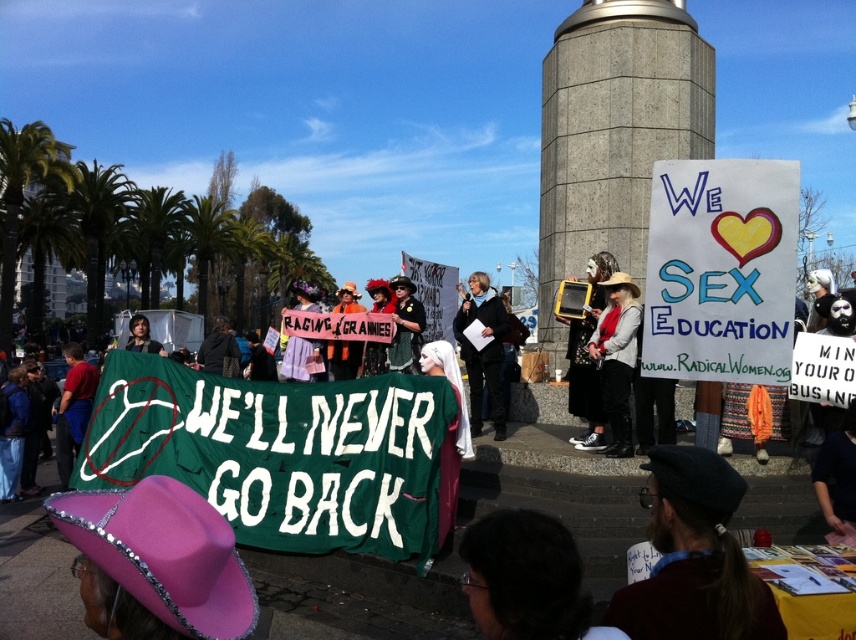
Question: Which point is farther from the camera taking this photo?

Choices:
 (A) (587, 364)
 (B) (483, 314)

Answer: (B)

Question: In this image, where is white knit sweater at center located relative to matte black dress at center?

Choices:
 (A) left
 (B) right

Answer: (B)

Question: Is black matte jacket at center to the left of yellow plastic sign at center from the viewer's perspective?

Choices:
 (A) yes
 (B) no

Answer: (A)

Question: Considering the relative positions of white knit sweater at center and matte black dress at center in the image provided, where is white knit sweater at center located with respect to matte black dress at center?

Choices:
 (A) left
 (B) right

Answer: (B)

Question: Which object is the farthest from the white knit sweater at center?

Choices:
 (A) yellow plastic sign at center
 (B) brown wool beret at lower center

Answer: (B)

Question: Based on their relative distances, which object is nearer to the black matte jacket at center?

Choices:
 (A) white knit sweater at center
 (B) yellow plastic sign at center

Answer: (B)